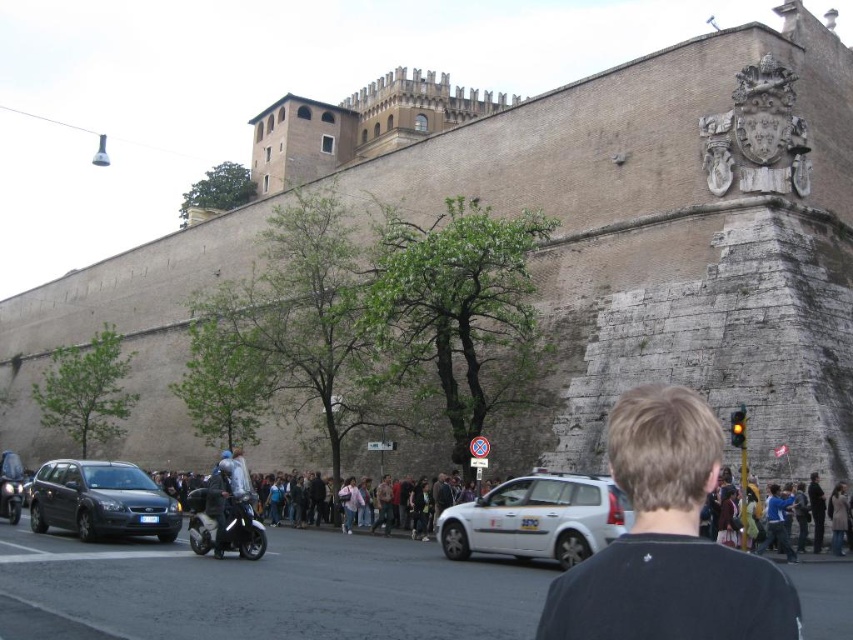
You are a pedestrian standing on the sidewalk. You see a white matte hatchback at center and a dark blue leather jacket at center. Which object is narrower from your perspective?

The white matte hatchback at center is thinner than the dark blue leather jacket at center, so the white matte hatchback at center is narrower.

Looking at this image, you are a photographer standing in the middle of the street. You want to take a photo of the black shirt at center and dark blue leather jacket at center. Which clothing item will appear wider in the photo?

The dark blue leather jacket at center will appear wider in the photo because it has a greater width than the black shirt at center.

You are a delivery driver needing to park your vehicle in a narrow alley that can only accommodate cars narrower than 1.8 meters. You see a white matte hatchback at center and a matte black car at lower left in the scene. Which car should you choose to park in the alley?

The white matte hatchback at center has a width less than the matte black car at lower left, so you should choose the white matte hatchback at center since it is narrower and can fit in the alley.